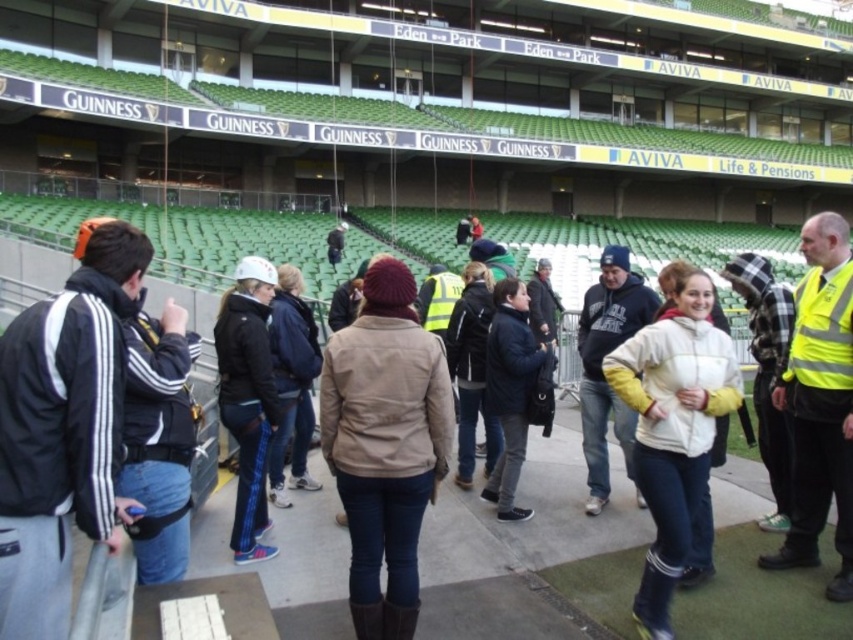
Between beige fabric jacket at center and matte black jacket at center, which one is positioned higher?

matte black jacket at center is above.

Is beige fabric jacket at center smaller than matte black jacket at center?

No.

Is point (392, 317) positioned in front of point (242, 518)?

Yes, it is in front of point (242, 518).

I want to click on beige fabric jacket at center, so click(x=386, y=444).

I want to click on matte black jacket at center, so click(x=248, y=397).

Does point (250, 513) lie behind point (498, 420)?

That is False.

Describe the element at coordinates (248, 397) in the screenshot. The width and height of the screenshot is (853, 640). I see `matte black jacket at center` at that location.

Locate an element on the screen. matte black jacket at center is located at coordinates click(x=248, y=397).

Does white fleece jacket at center have a larger size compared to matte black jacket at center?

Yes.

Who is more forward, (646, 468) or (251, 365)?

Point (646, 468) is more forward.

You are a GUI agent. You are given a task and a screenshot of the screen. Output one action in this format:
    pyautogui.click(x=<x>, y=<y>)
    Task: Click on the white fleece jacket at center
    Image resolution: width=853 pixels, height=640 pixels.
    Given the screenshot: What is the action you would take?
    pyautogui.click(x=672, y=428)